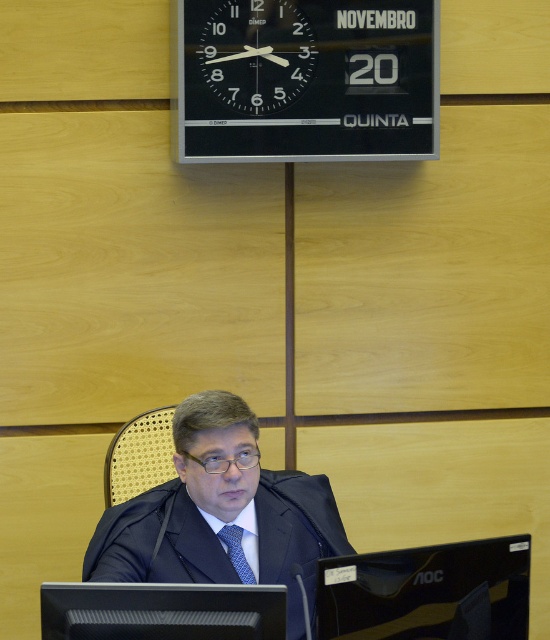
Between point (213, 410) and point (41, 625), which one is positioned behind?

Positioned behind is point (213, 410).

Which is below, matte black suit at center or black matte computer monitor at lower center?

Positioned lower is black matte computer monitor at lower center.

Who is more forward, [306,513] or [222,637]?

Point [222,637] is in front.

The image size is (550, 640). In order to click on matte black suit at center in this screenshot , I will do `click(221, 513)`.

Does black glass clock at upper center have a greater height compared to blue silk tie at center?

Correct, black glass clock at upper center is much taller as blue silk tie at center.

Which of these two, black glass clock at upper center or blue silk tie at center, stands taller?

black glass clock at upper center

Where is `black glass clock at upper center`? black glass clock at upper center is located at coordinates (256, 54).

Where is `black glass clock at upper center`? This screenshot has height=640, width=550. black glass clock at upper center is located at coordinates (256, 54).

Between black glossy monitor at lower center and black glass clock at upper center, which one has less height?

black glossy monitor at lower center is shorter.

You are a GUI agent. You are given a task and a screenshot of the screen. Output one action in this format:
    pyautogui.click(x=<x>, y=<y>)
    Task: Click on the black glossy monitor at lower center
    The height and width of the screenshot is (640, 550).
    Given the screenshot: What is the action you would take?
    pyautogui.click(x=427, y=593)